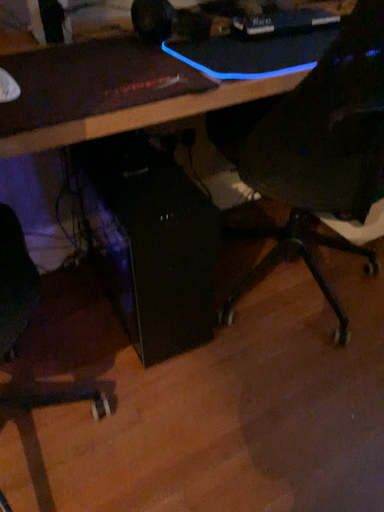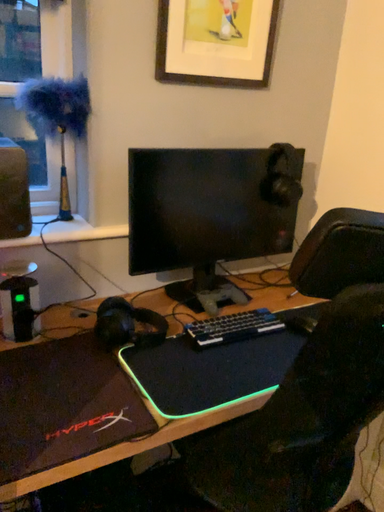
Question: How did the camera likely rotate when shooting the video?

Choices:
 (A) rotated downward
 (B) rotated upward

Answer: (B)